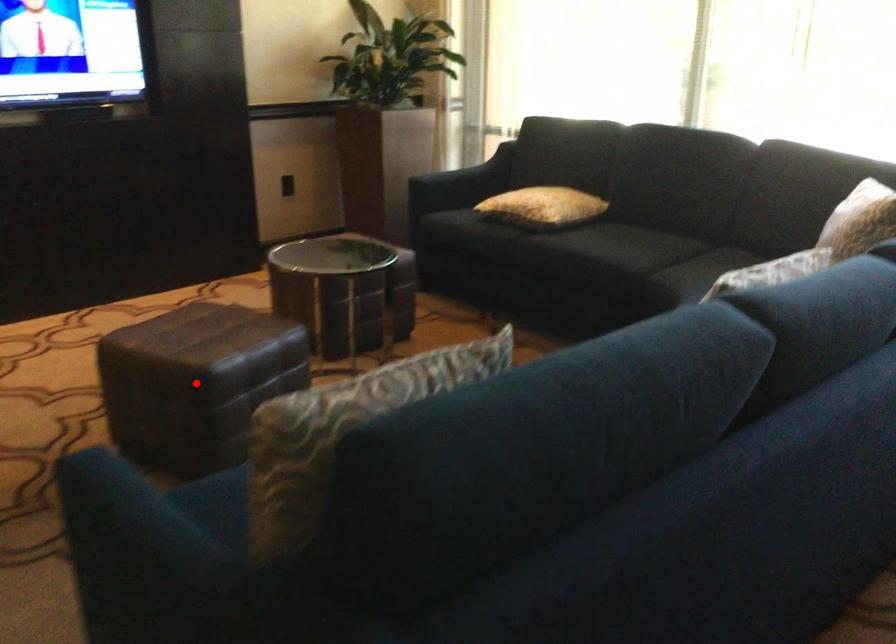
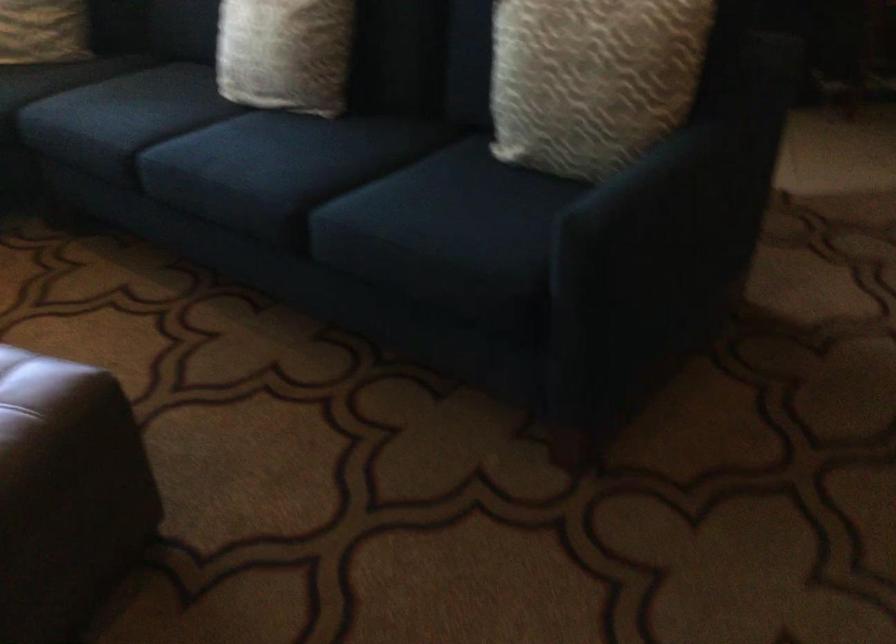
The point at the highlighted location is marked in the first image. Where is the corresponding point in the second image?

(135, 391)